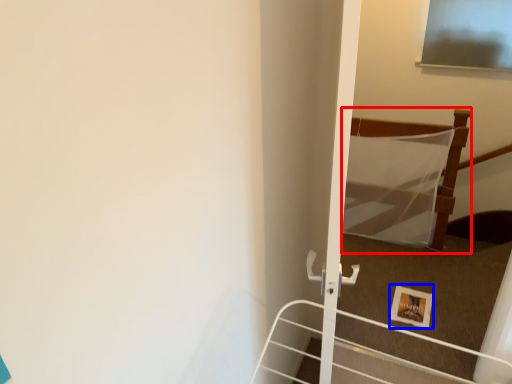
Question: Which object is closer to the camera taking this photo, bed (highlighted by a red box) or picture frame (highlighted by a blue box)?

Choices:
 (A) bed
 (B) picture frame

Answer: (B)